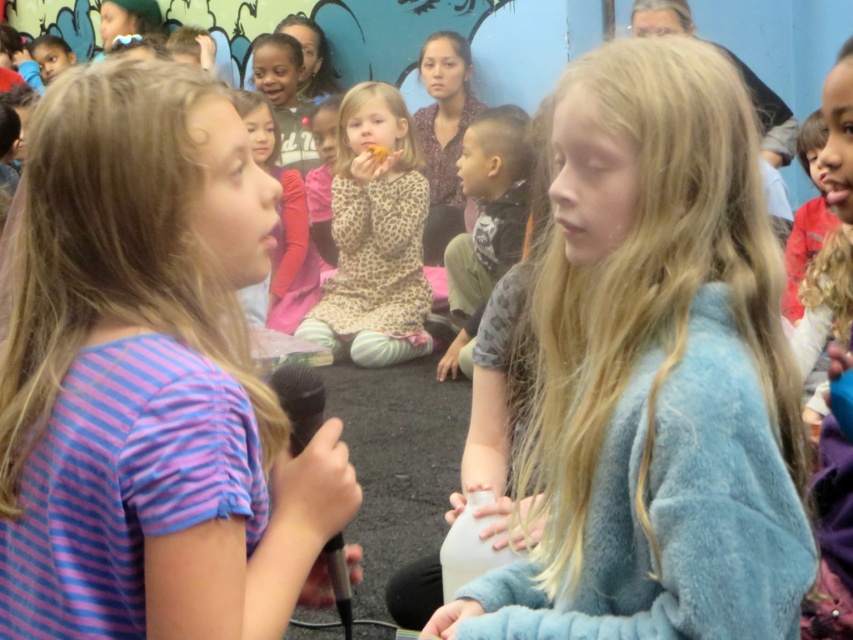
Who is positioned more to the right, blue fuzzy sweater at center or leopard print dress at center?

blue fuzzy sweater at center

Is point (717, 636) positioned before point (343, 308)?

Yes, it is.

Where is `blue fuzzy sweater at center`? The height and width of the screenshot is (640, 853). blue fuzzy sweater at center is located at coordinates (654, 372).

Does blue fuzzy sweater at center appear over purple striped shirt at center?

No.

Where is `blue fuzzy sweater at center`? The image size is (853, 640). blue fuzzy sweater at center is located at coordinates (654, 372).

Does point (734, 493) come in front of point (204, 161)?

Yes.

Locate an element on the screen. blue fuzzy sweater at center is located at coordinates (654, 372).

Is dark gray textured shirt at center taller than white matte bottle at center?

Indeed, dark gray textured shirt at center has a greater height compared to white matte bottle at center.

Who is positioned more to the right, dark gray textured shirt at center or white matte bottle at center?

dark gray textured shirt at center is more to the right.

You are a GUI agent. You are given a task and a screenshot of the screen. Output one action in this format:
    pyautogui.click(x=<x>, y=<y>)
    Task: Click on the dark gray textured shirt at center
    Image resolution: width=853 pixels, height=640 pixels.
    Given the screenshot: What is the action you would take?
    pyautogui.click(x=486, y=220)

At what (x,y) coordinates should I click in order to perform the action: click on dark gray textured shirt at center. Please return your answer as a coordinate pair (x, y). The width and height of the screenshot is (853, 640). Looking at the image, I should click on (486, 220).